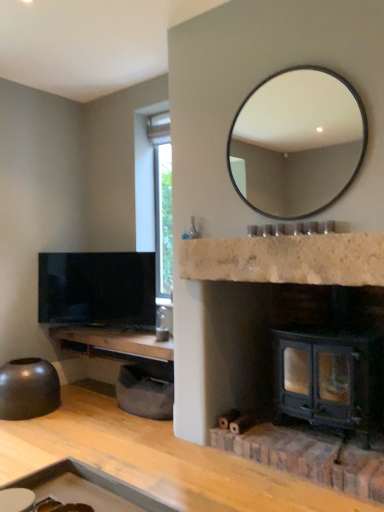
This screenshot has height=512, width=384. In order to click on empty space that is ontop of matte black mirror at upper center in this screenshot , I will do `click(294, 64)`.